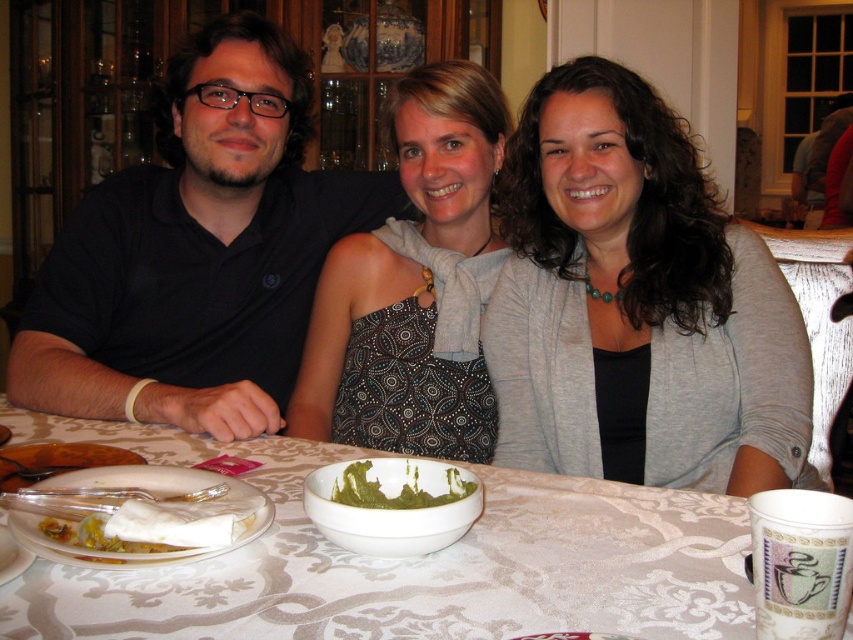
Question: Which is nearer to the gray knit cardigan at center?

Choices:
 (A) white ceramic plate at lower left
 (B) matte black shirt at left
 (C) green creamy sauce at center

Answer: (B)

Question: Does black matte shirt at left have a larger size compared to white ceramic plate at lower left?

Choices:
 (A) yes
 (B) no

Answer: (A)

Question: Which of these objects is positioned farthest from the white lace tablecloth at center?

Choices:
 (A) green creamy sauce at center
 (B) gray knit cardigan at center

Answer: (B)

Question: Is matte black shirt at left bigger than patterned fabric dress at center?

Choices:
 (A) yes
 (B) no

Answer: (A)

Question: Among these points, which one is farthest from the camera?

Choices:
 (A) (302, 301)
 (B) (677, 388)
 (C) (61, 541)

Answer: (A)

Question: Does white lace tablecloth at center have a smaller size compared to matte black shirt at left?

Choices:
 (A) no
 (B) yes

Answer: (B)